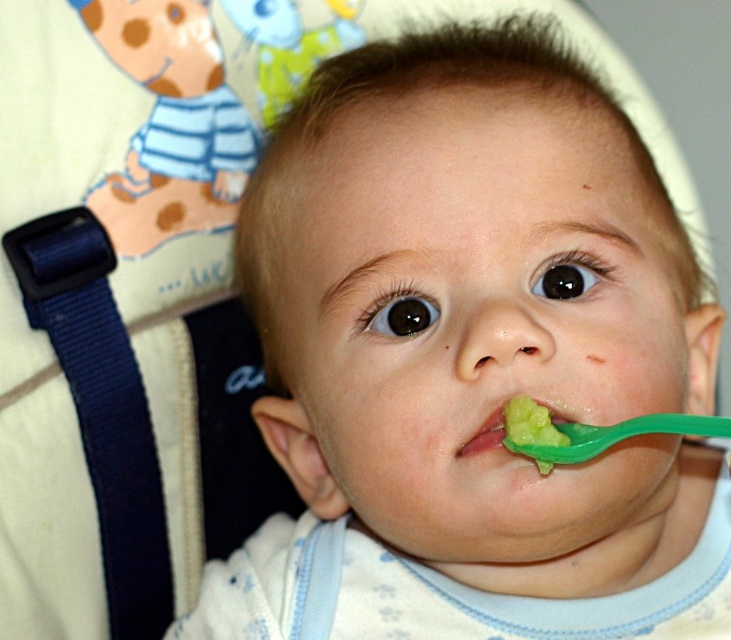
Looking at this image, you are a photographer trying to capture the baby feeding scene. You notice two points in the image at coordinates point (610, 428) and point (530, 422). If you want to focus on the point that is closer to the camera, which coordinate should you choose?

Point (530, 422) is closer to the camera than point (610, 428), so you should choose point (530, 422) to focus on.

You are a parent trying to choose between two green plastic spoons for your baby. The baby is currently holding the green plastic spoon at mouth and there is another green plastic spoon at lower center on the tray. Which spoon is wider?

The green plastic spoon at mouth is wider than the green plastic spoon at lower center.